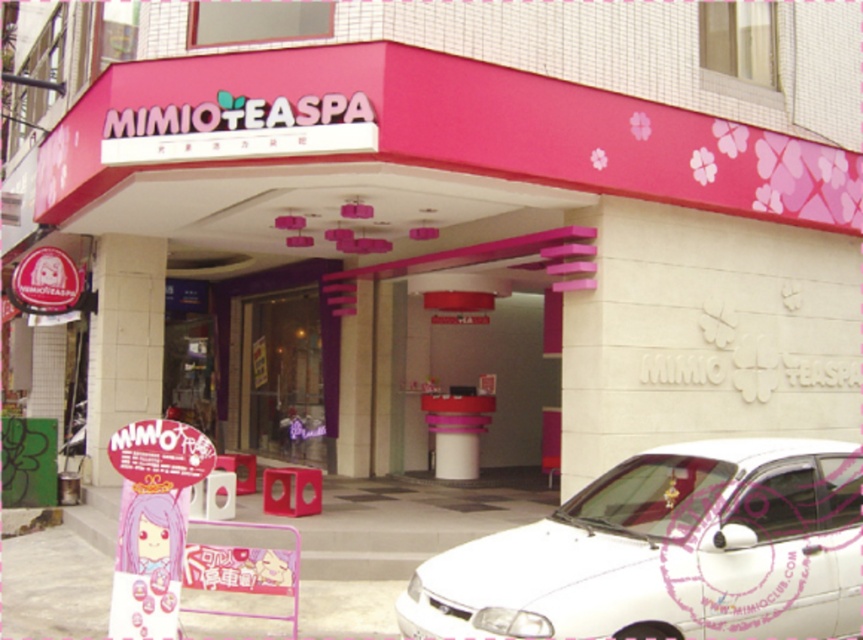
You are a visitor approaching the entrance of MIMIO TEASPA and need to locate the transparent glass door at center. Considering the white textured pillar at left, which object is closer to the entrance pathway?

The transparent glass door at center is closer to the entrance pathway because the white textured pillar at left has a smaller size, indicating it is farther away.

You are standing at the entrance of MIMIO TEASPA and want to locate two specific points inside the spa. The first point is at coordinate point (779,496) and the second is at point (139,390). Which of these points is nearer to your current position?

Point (779,496) is closer to the viewer than point (139,390), so the first point is nearer to your current position.

You are standing at the entrance of MIMIO TEASPA and want to park your car. The parking lot is a rectangular area extending from the entrance to the right side. The entrance is at the bottom left corner of the parking lot. The parking lot has a maximum length of 10 meters from the entrance to the farthest point. Can the white glossy car at lower right park within the parking lot?

The white glossy car at lower right is located at point (666, 552). Since the parking lot extends 10 meters from the entrance, the car can park within the parking lot as its position is within the designated area.